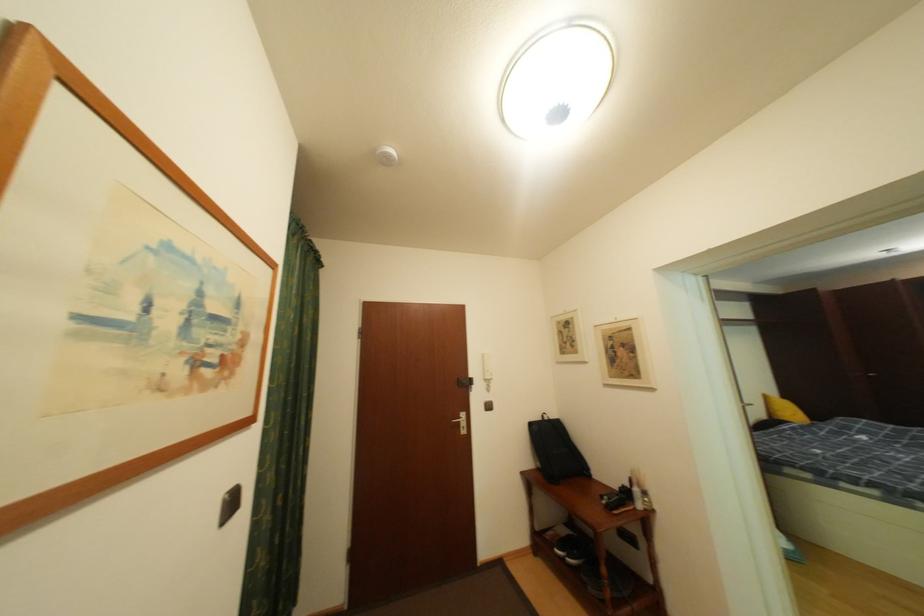
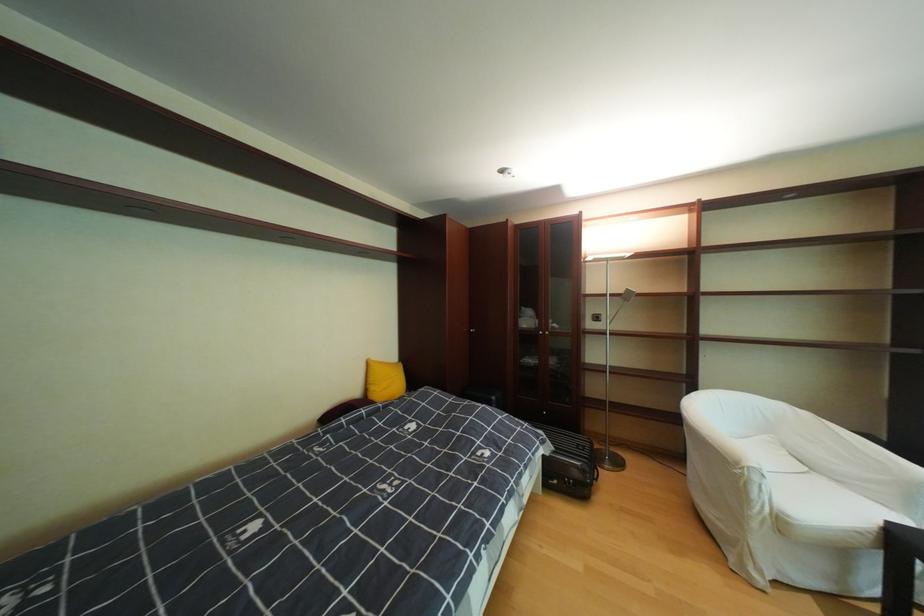
Find the pixel in the second image that matches pixel 776 398 in the first image.

(380, 363)